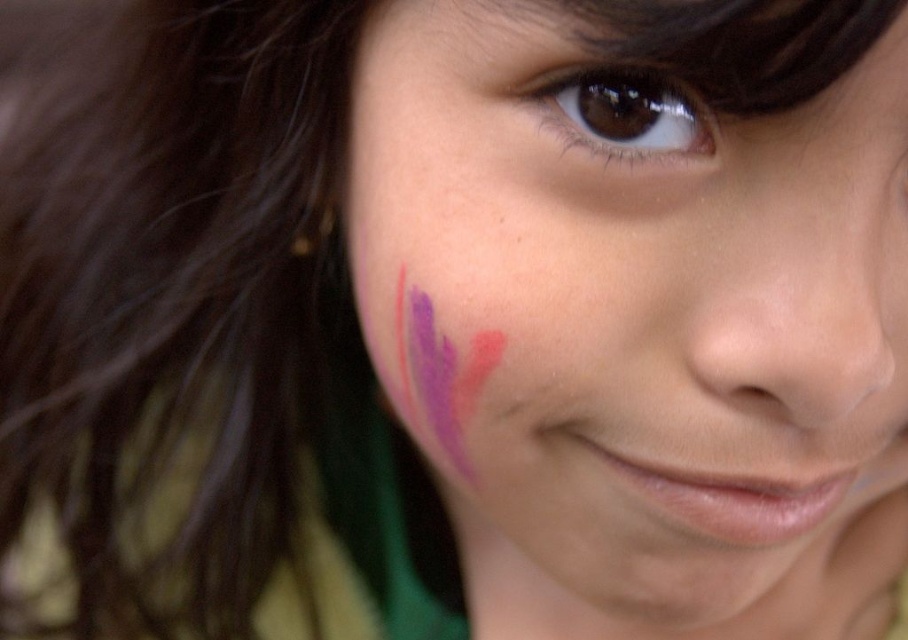
Is point (360, 243) closer to camera compared to point (563, 124)?

No, (360, 243) is further to viewer.

Which is above, purple matte paint at left or brown glossy eye at upper center?

brown glossy eye at upper center is above.

This screenshot has width=908, height=640. What are the coordinates of `purple matte paint at left` in the screenshot? It's located at (637, 326).

You are a GUI agent. You are given a task and a screenshot of the screen. Output one action in this format:
    pyautogui.click(x=<x>, y=<y>)
    Task: Click on the purple matte paint at left
    This screenshot has height=640, width=908.
    Given the screenshot: What is the action you would take?
    pyautogui.click(x=637, y=326)